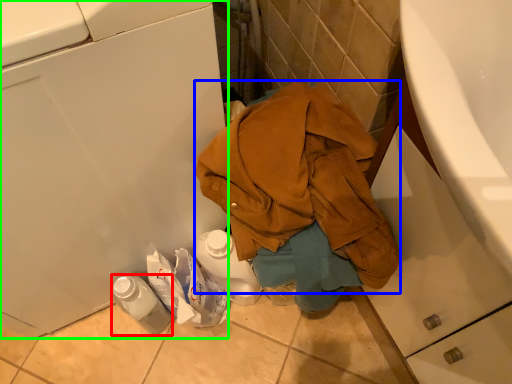
Question: Which is farther away from bottle (highlighted by a red box)? waste (highlighted by a blue box) or washing machine (highlighted by a green box)?

Choices:
 (A) waste
 (B) washing machine

Answer: (A)